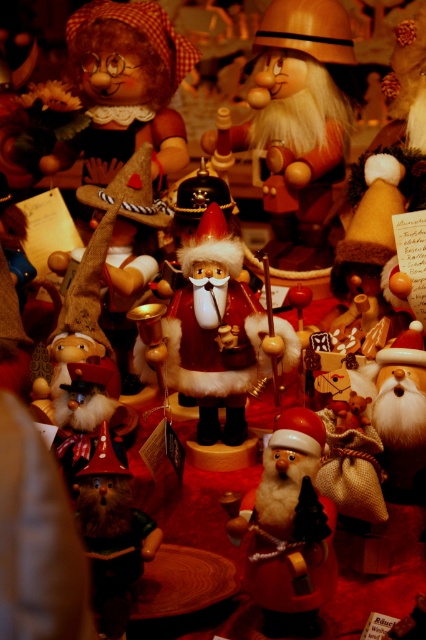
Is fuzzy red santa at center above wooden gnome at center?

Correct, fuzzy red santa at center is located above wooden gnome at center.

Is fuzzy red santa at center taller than wooden gnome at center?

Yes, fuzzy red santa at center is taller than wooden gnome at center.

Where is `fuzzy red santa at center`? This screenshot has height=640, width=426. fuzzy red santa at center is located at coordinates (290, 529).